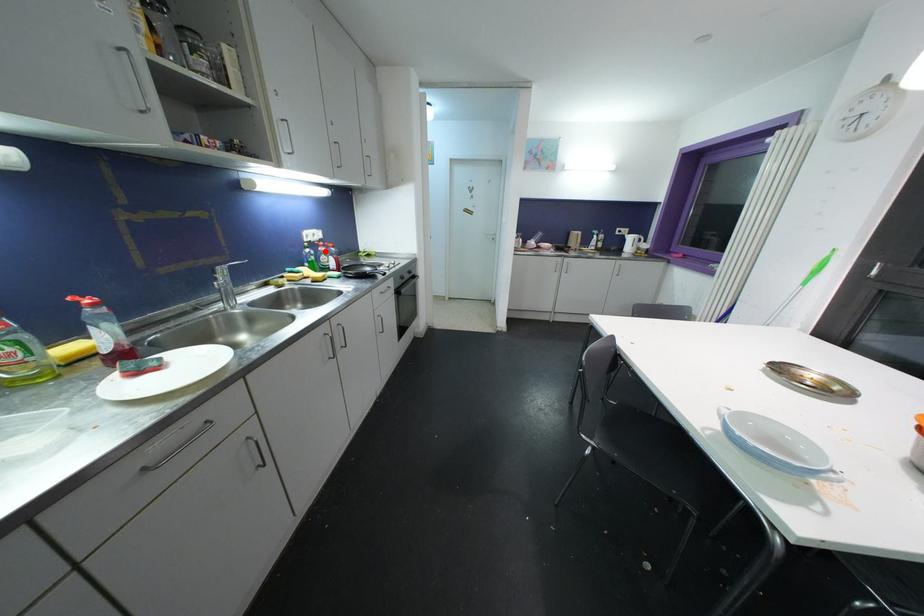
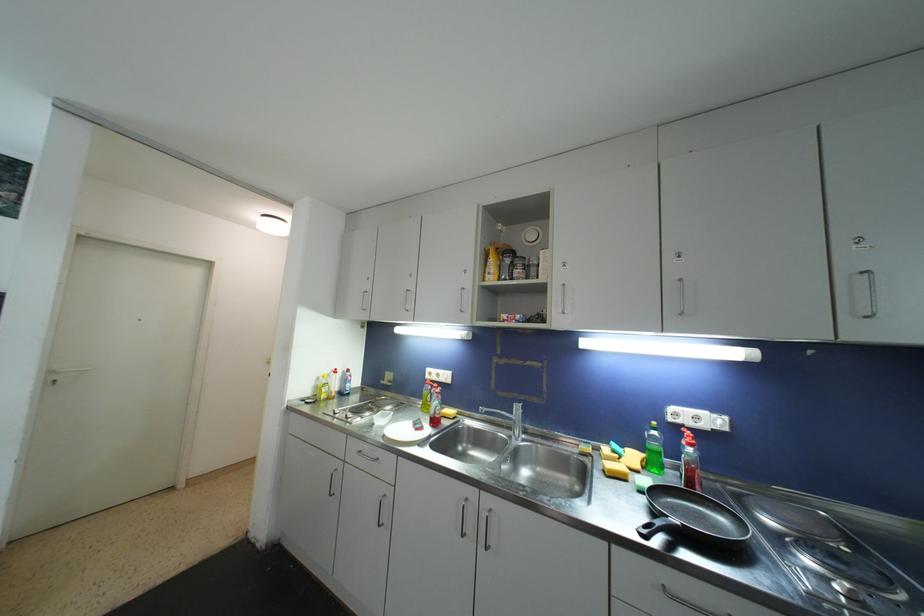
The point at the highlighted location is marked in the first image. Where is the corresponding point in the second image?

(687, 445)